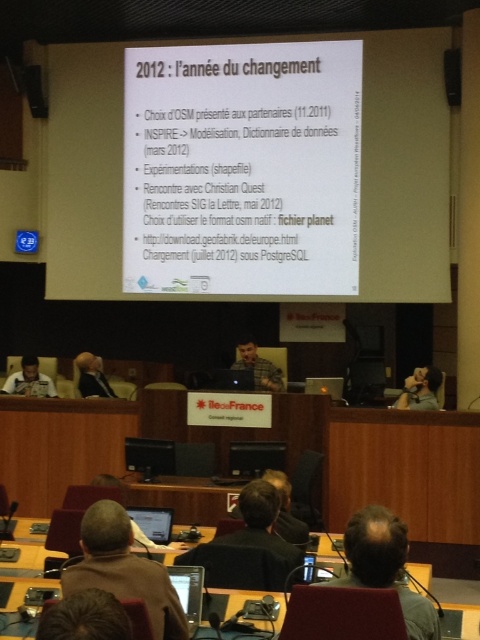
You are an attendee at the presentation and you see the white paper at center and the black fabric jacket at center. Which object is located to the left side of the other?

The white paper at center is positioned on the left side of black fabric jacket at center.

You are an attendee at the conference and see the white paper at center and the matte black person at lower right. Which object is positioned higher in the image?

The white paper at center is positioned higher than the matte black person at lower right.

You are an attendee at the conference and you need to hand out a document to the person at the lower right. The white paper at center is blocking your view. Can you still see the matte black person at lower right?

The white paper at center is larger in size than matte black person at lower right, so it might block your view of the matte black person at lower right. You may need to move to a different angle to see them clearly.